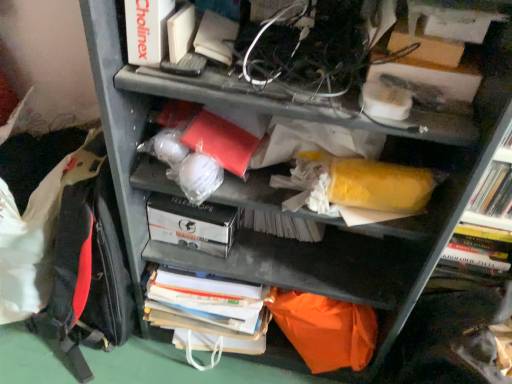
Question: Considering the positions of white matte book at upper left, which is the 1th paperback book from top to bottom, and red fabric backpack at left in the image, is white matte book at upper left, which is the 1th paperback book from top to bottom, taller or shorter than red fabric backpack at left?

Choices:
 (A) short
 (B) tall

Answer: (A)

Question: In terms of width, does white matte book at upper left, the 1th paperback book in the front-to-back sequence, look wider or thinner when compared to red fabric backpack at left?

Choices:
 (A) thin
 (B) wide

Answer: (A)

Question: Estimate the real-world distances between objects in this image. Which object is farther from the white matte book at upper left, the 1th paperback book in the front-to-back sequence?

Choices:
 (A) yellow matte bookshelf at right
 (B) red fabric backpack at left
 (C) white cardboard box at center, the 2th paperback book in the front-to-back sequence

Answer: (A)

Question: Which object is positioned closest to the yellow matte bookshelf at right?

Choices:
 (A) white matte book at upper left, positioned as the second paperback book in bottom-to-top order
 (B) white cardboard box at center, marked as the first paperback book in a bottom-to-top arrangement
 (C) red fabric backpack at left

Answer: (B)